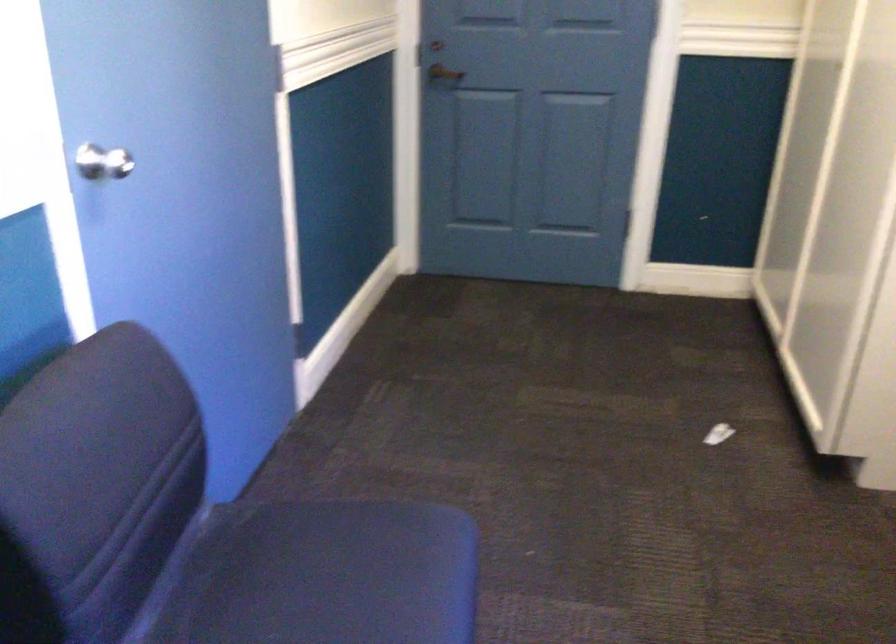
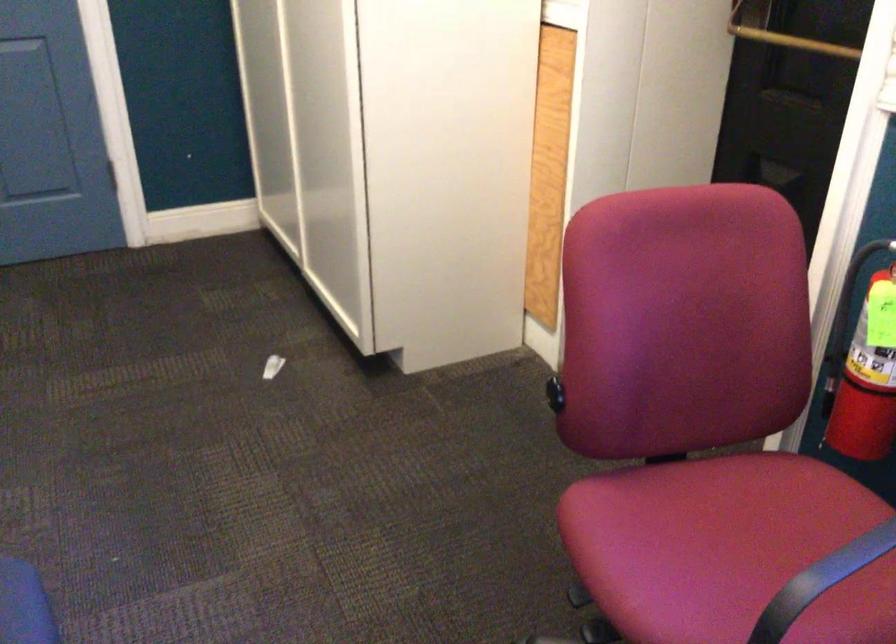
Question: The images are taken continuously from a first-person perspective. In which direction is your viewpoint rotating?

Choices:
 (A) Left
 (B) Right
 (C) Up
 (D) Down

Answer: (B)